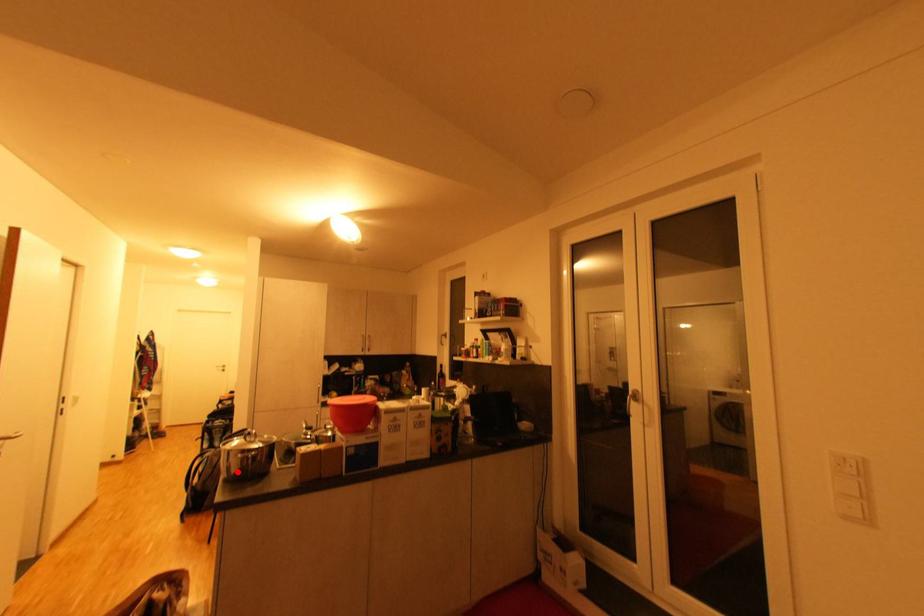
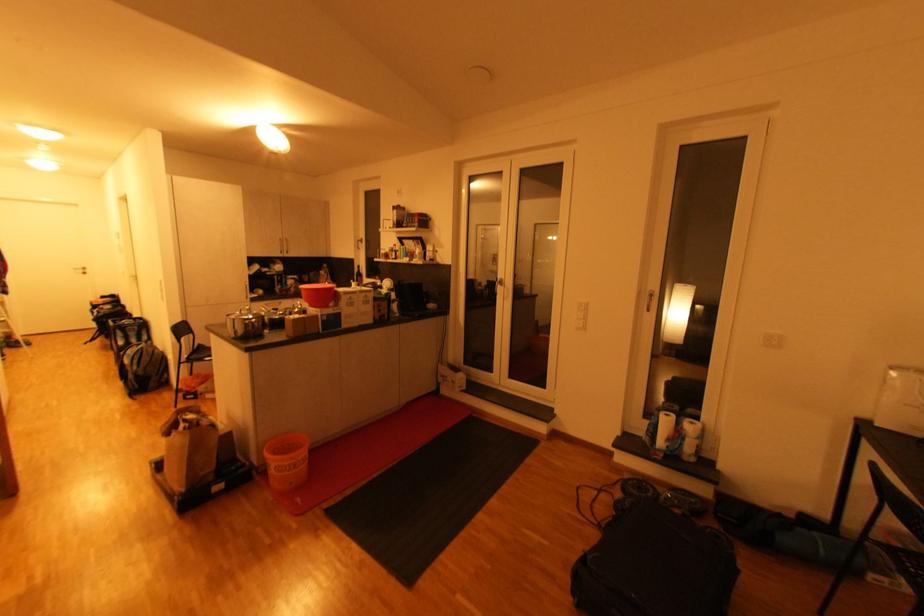
Locate, in the second image, the point that corresponds to the highlighted location in the first image.

(245, 334)